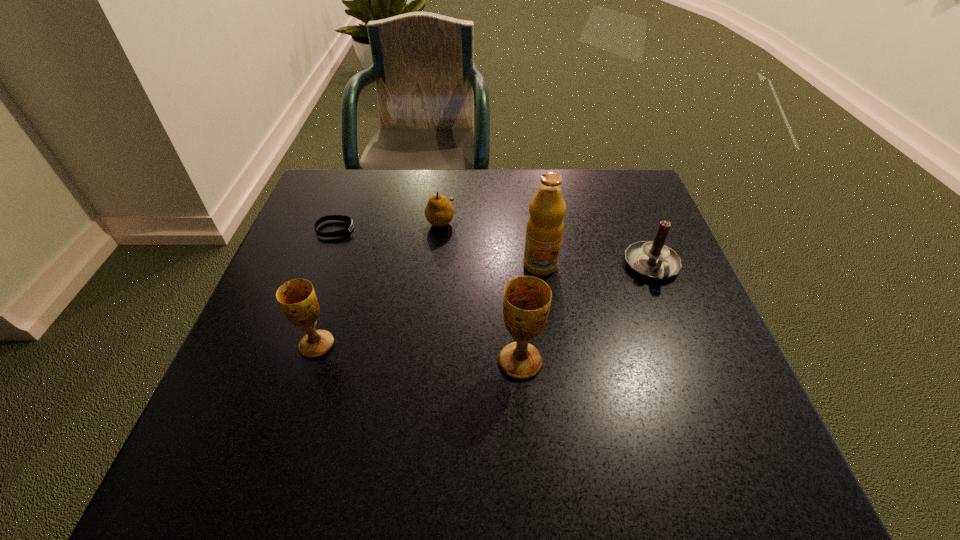
Please point out where to position a new chalice on the right to maintain spacing. Please provide its 2D coordinates. Your answer should be formatted as a tuple, i.e. [(x, y)], where the tuple contains the x and y coordinates of a point satisfying the conditions above.

[(737, 380)]